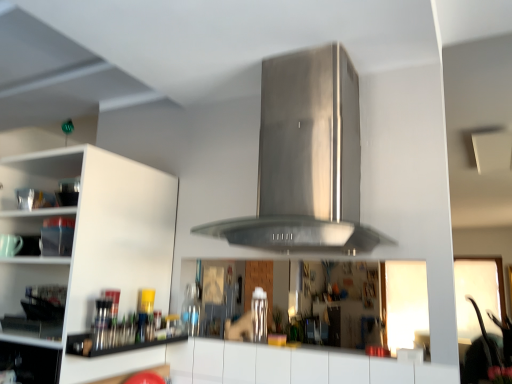
Find the location of a particular element. This screenshot has height=384, width=512. empty space that is ontop of metallic silver utensils at lower left (from a real-world perspective) is located at coordinates (132, 329).